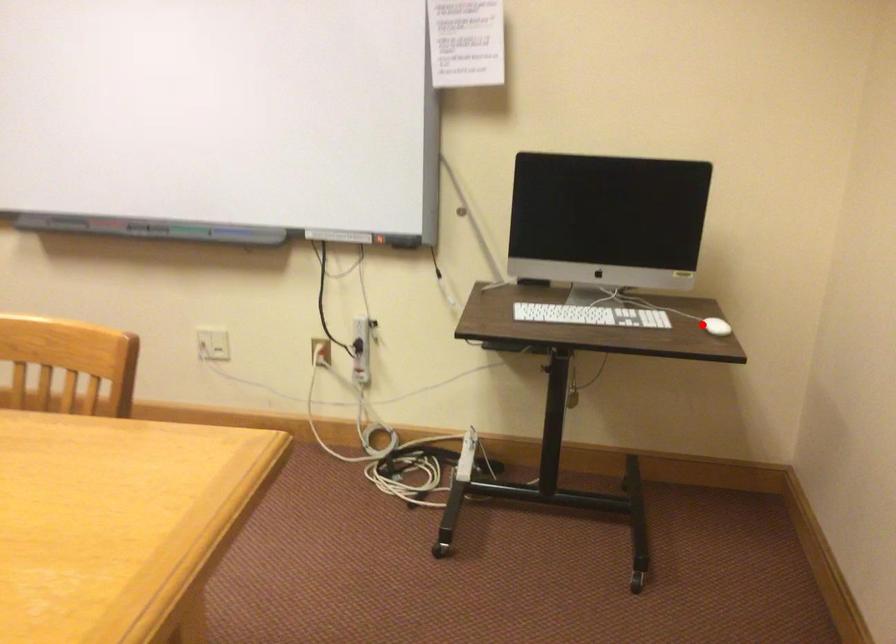
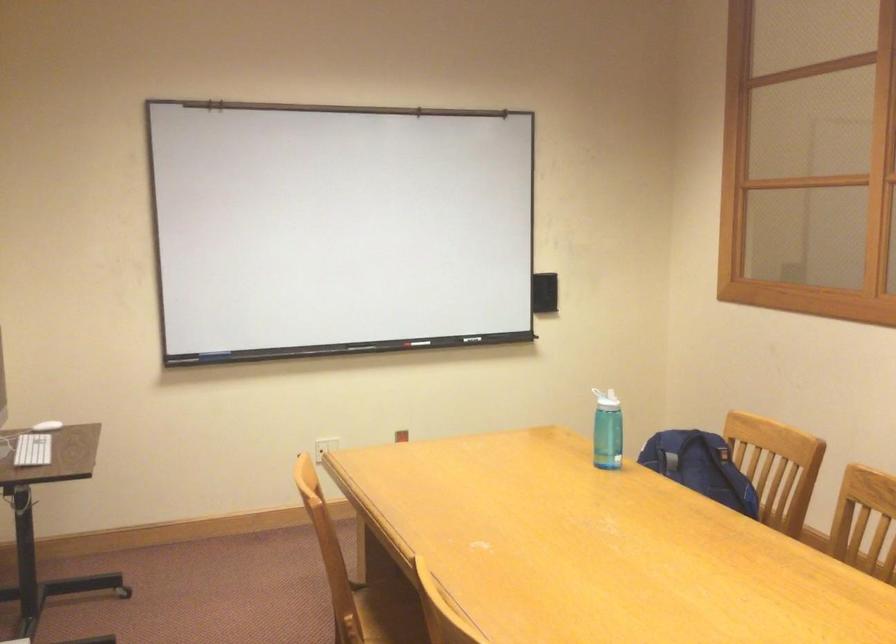
Locate, in the second image, the point that corresponds to the highlighted location in the first image.

(47, 426)